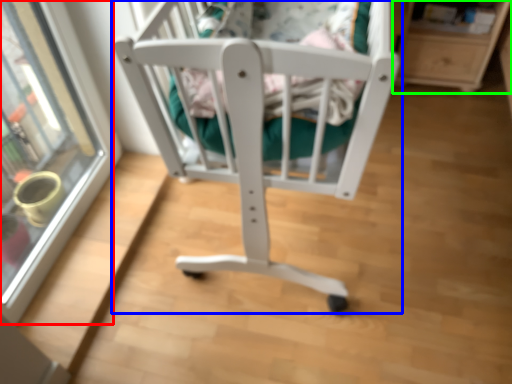
Question: Which is nearer to the glass door (highlighted by a red box)? furniture (highlighted by a blue box) or shelf (highlighted by a green box).

Choices:
 (A) furniture
 (B) shelf

Answer: (A)